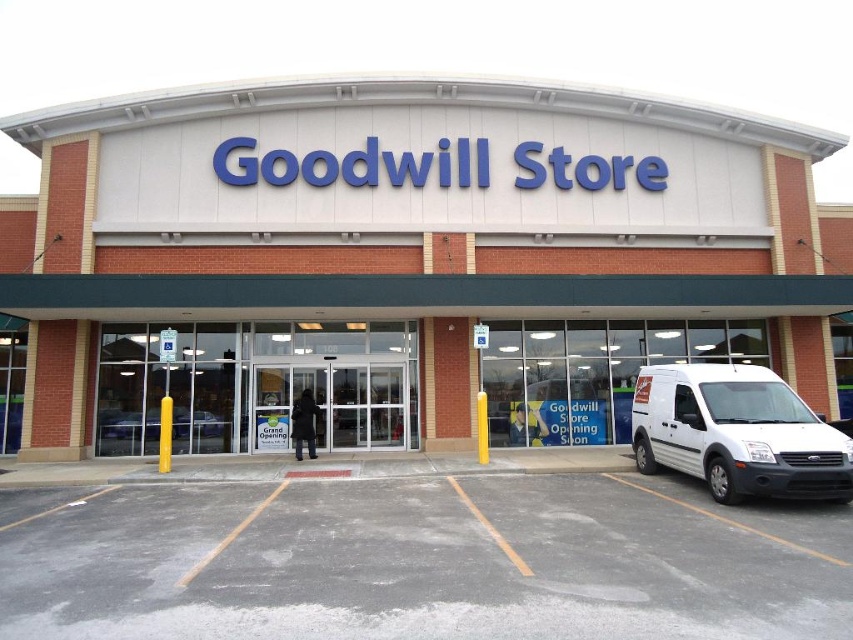
Does white matte goodwill store at center appear on the left side of white matte van at lower right?

Correct, you'll find white matte goodwill store at center to the left of white matte van at lower right.

Can you confirm if white matte goodwill store at center is positioned below white matte van at lower right?

No, white matte goodwill store at center is not below white matte van at lower right.

Is point (502, 109) farther from camera compared to point (828, 472)?

Yes, it is.

Locate an element on the screen. This screenshot has width=853, height=640. white matte goodwill store at center is located at coordinates click(x=405, y=260).

Who is more forward, (216, 332) or (177, 412)?

Point (177, 412) is in front.

Image resolution: width=853 pixels, height=640 pixels. What are the coordinates of `white matte goodwill store at center` in the screenshot? It's located at (405, 260).

Can you confirm if gray asphalt parking lot at center is thinner than white matte van at lower right?

In fact, gray asphalt parking lot at center might be wider than white matte van at lower right.

Does gray asphalt parking lot at center appear under white matte van at lower right?

Correct, gray asphalt parking lot at center is located below white matte van at lower right.

Identify the location of gray asphalt parking lot at center. (421, 561).